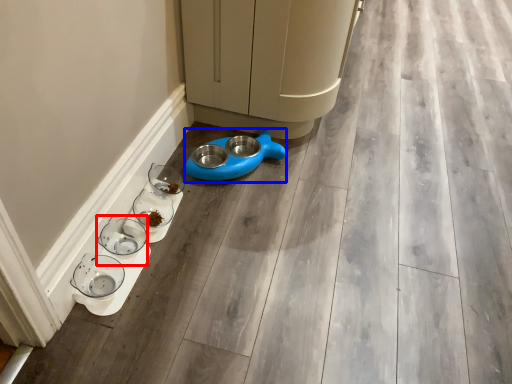
Question: Which of the following is the closest to the observer, glass bowl (highlighted by a red box) or appliance (highlighted by a blue box)?

Choices:
 (A) glass bowl
 (B) appliance

Answer: (A)